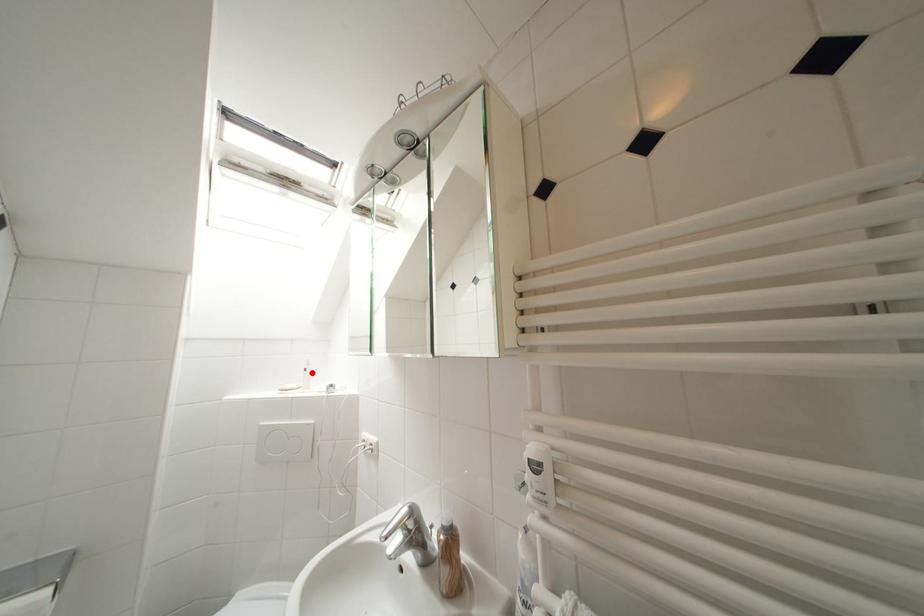
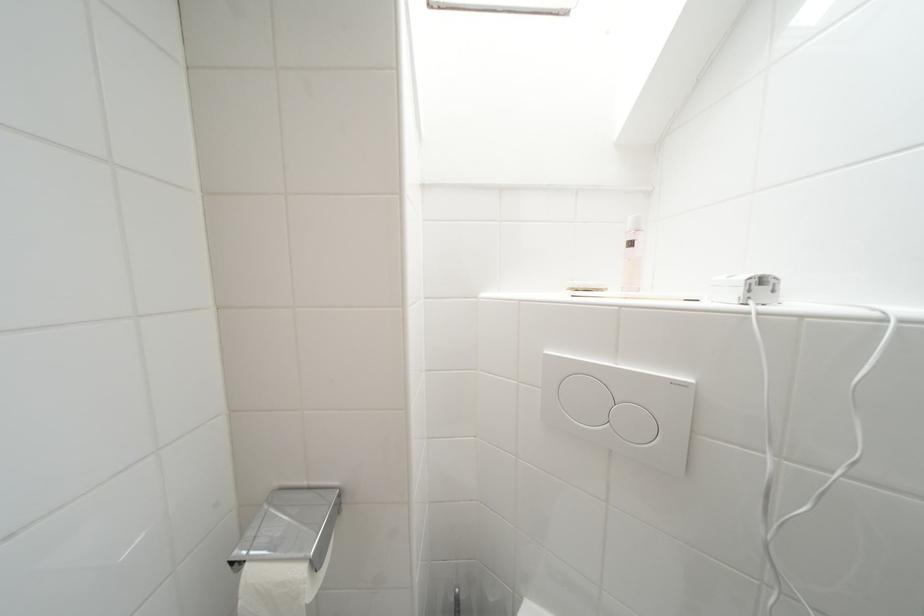
In the second image, find the point that corresponds to the highlighted location in the first image.

(638, 246)